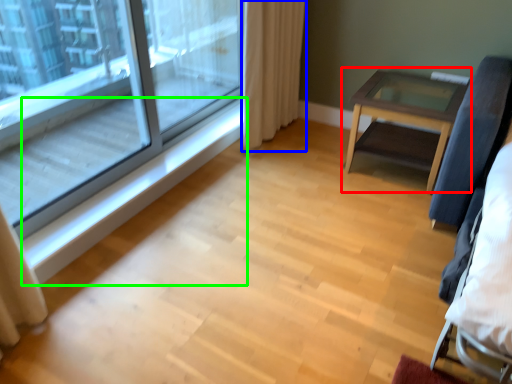
Question: Based on their relative distances, which object is nearer to table (highlighted by a red box)? Choose from curtain (highlighted by a blue box) and window sill (highlighted by a green box).

Choices:
 (A) curtain
 (B) window sill

Answer: (A)